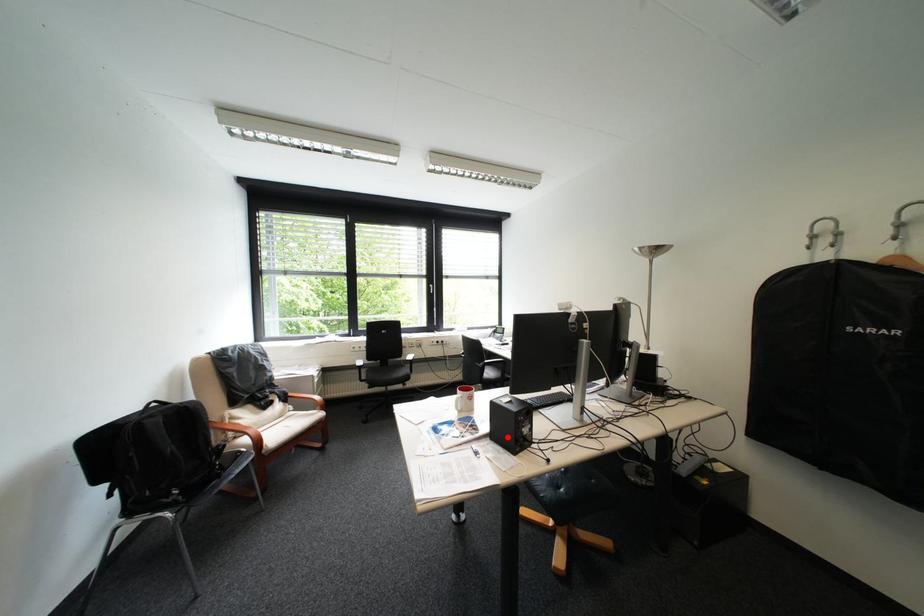
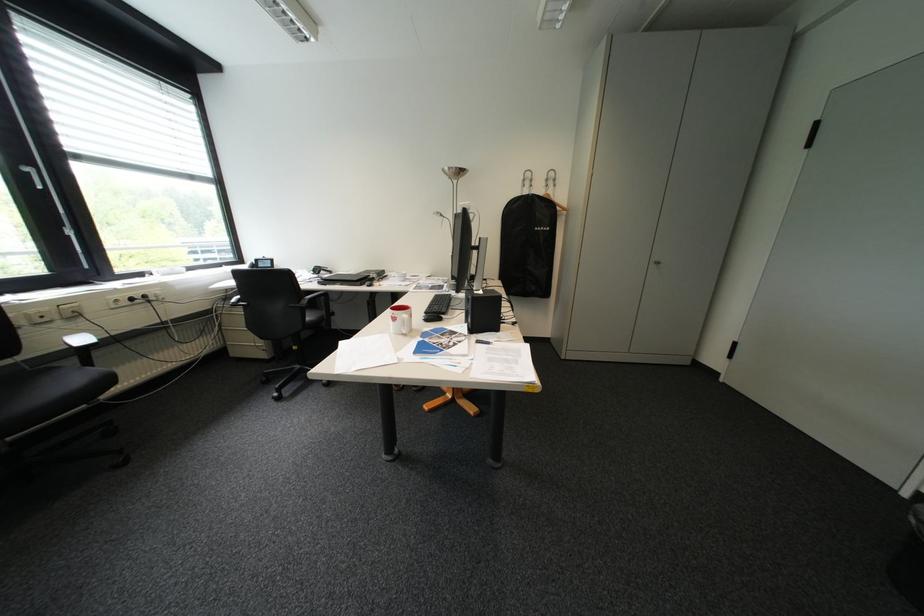
Locate, in the second image, the point that corresponds to the highlighted location in the first image.

(484, 331)